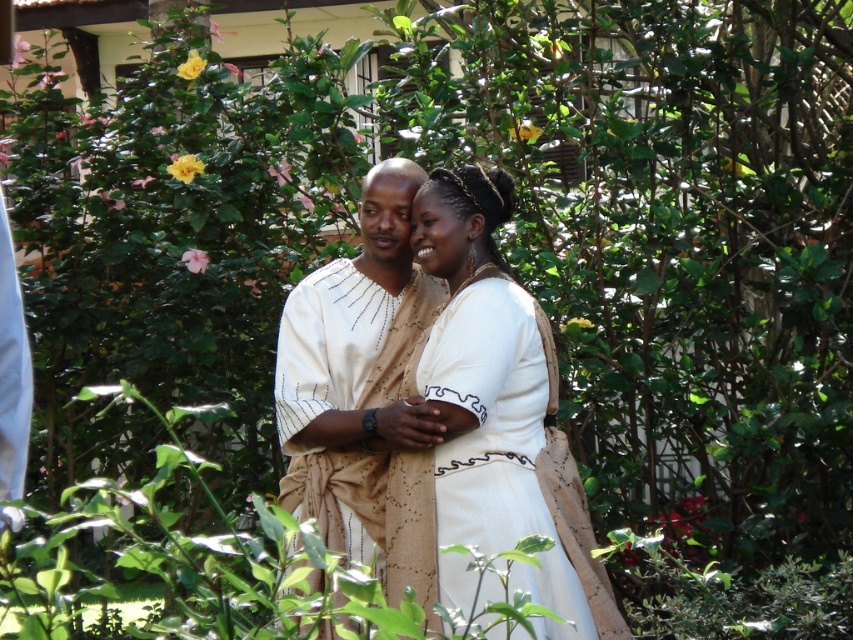
Which of these two, white textured dress at center or beige textured robe at center, stands shorter?

beige textured robe at center

Can you confirm if white textured dress at center is positioned above beige textured robe at center?

No, white textured dress at center is not above beige textured robe at center.

Where is `white textured dress at center`? white textured dress at center is located at coordinates (486, 400).

What are the coordinates of `white textured dress at center` in the screenshot? It's located at (486, 400).